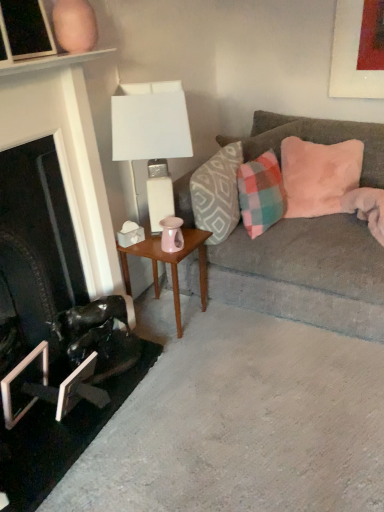
What do you see at coordinates (16, 377) in the screenshot?
I see `metallic silver picture frame at lower left, which is the second picture frame in top-to-bottom order` at bounding box center [16, 377].

The width and height of the screenshot is (384, 512). Describe the element at coordinates (305, 273) in the screenshot. I see `velvet gray couch at right` at that location.

The image size is (384, 512). Find the location of `metallic silver picture frame at lower left, which appears as the first picture frame when ordered from the bottom`. metallic silver picture frame at lower left, which appears as the first picture frame when ordered from the bottom is located at coordinates (80, 389).

In order to face metallic silver picture frame at lower left, which ranks as the 3th picture frame in top-to-bottom order, should I rotate leftwards or rightwards?

A 14.842 degree turn to the left will do.

Identify the location of matte black picture frame at upper left, the first picture frame viewed from the top. (26, 29).

Where is `plaid fabric pillow at right, the 2th pillow when ordered from right to left`? Image resolution: width=384 pixels, height=512 pixels. plaid fabric pillow at right, the 2th pillow when ordered from right to left is located at coordinates (261, 193).

Can we say shiny black swivel chair at lower left lies outside pink plush pillow at upper right, arranged as the third pillow when viewed from the left?

Indeed, shiny black swivel chair at lower left is completely outside pink plush pillow at upper right, arranged as the third pillow when viewed from the left.

Considering the sizes of objects shiny black swivel chair at lower left and pink plush pillow at upper right, arranged as the third pillow when viewed from the left, in the image provided, who is wider, shiny black swivel chair at lower left or pink plush pillow at upper right, arranged as the third pillow when viewed from the left,?

Wider between the two is pink plush pillow at upper right, arranged as the third pillow when viewed from the left.

Is shiny black swivel chair at lower left to the left of pink plush pillow at upper right, arranged as the third pillow when viewed from the left, from the viewer's perspective?

Indeed, shiny black swivel chair at lower left is positioned on the left side of pink plush pillow at upper right, arranged as the third pillow when viewed from the left.

From a real-world perspective, is shiny black swivel chair at lower left positioned above or below pink plush pillow at upper right, arranged as the third pillow when viewed from the left?

shiny black swivel chair at lower left is situated lower than pink plush pillow at upper right, arranged as the third pillow when viewed from the left, in the real world.

Considering the relative sizes of matte black picture frame at upper left, the first picture frame viewed from the top, and wooden side table at center in the image provided, is matte black picture frame at upper left, the first picture frame viewed from the top, smaller than wooden side table at center?

Correct, matte black picture frame at upper left, the first picture frame viewed from the top, occupies less space than wooden side table at center.

Is matte black picture frame at upper left, which is the third picture frame in bottom-to-top order, turned away from wooden side table at center?

No, matte black picture frame at upper left, which is the third picture frame in bottom-to-top order, is not facing away from wooden side table at center.

From the picture: Does matte black picture frame at upper left, which is the third picture frame in bottom-to-top order, appear on the left side of wooden side table at center?

Yes, matte black picture frame at upper left, which is the third picture frame in bottom-to-top order, is to the left of wooden side table at center.

From the image's perspective, relative to wooden side table at center, is matte black picture frame at upper left, the first picture frame viewed from the top, above or below?

matte black picture frame at upper left, the first picture frame viewed from the top, is above wooden side table at center.

Is the surface of wooden side table at center in direct contact with metallic silver picture frame at lower left, which is the second picture frame in top-to-bottom order?

There is a gap between wooden side table at center and metallic silver picture frame at lower left, which is the second picture frame in top-to-bottom order.

From the image's perspective, does wooden side table at center appear lower than metallic silver picture frame at lower left, which is the second picture frame in top-to-bottom order?

Actually, wooden side table at center appears above metallic silver picture frame at lower left, which is the second picture frame in top-to-bottom order, in the image.

Considering the relative positions of wooden side table at center and metallic silver picture frame at lower left, which is the 2th picture frame in bottom-to-top order, in the image provided, is wooden side table at center to the right of metallic silver picture frame at lower left, which is the 2th picture frame in bottom-to-top order, from the viewer's perspective?

Yes, wooden side table at center is to the right of metallic silver picture frame at lower left, which is the 2th picture frame in bottom-to-top order.

Does wooden side table at center have a lesser height compared to metallic silver picture frame at lower left, which is the 2th picture frame in bottom-to-top order?

Incorrect, the height of wooden side table at center does not fall short of that of metallic silver picture frame at lower left, which is the 2th picture frame in bottom-to-top order.

Considering the relative sizes of matte black picture frame at upper left, which is the third picture frame in bottom-to-top order, and plaid fabric pillow at right, the 2th pillow positioned from the left, in the image provided, is matte black picture frame at upper left, which is the third picture frame in bottom-to-top order, thinner than plaid fabric pillow at right, the 2th pillow positioned from the left,?

Indeed, matte black picture frame at upper left, which is the third picture frame in bottom-to-top order, has a lesser width compared to plaid fabric pillow at right, the 2th pillow positioned from the left.

Based on the photo, from a real-world perspective, is matte black picture frame at upper left, the first picture frame viewed from the top, physically below plaid fabric pillow at right, the 2th pillow positioned from the left?

No, from a real-world perspective, matte black picture frame at upper left, the first picture frame viewed from the top, is not beneath plaid fabric pillow at right, the 2th pillow positioned from the left.

Is plaid fabric pillow at right, the 2th pillow positioned from the left, at the back of matte black picture frame at upper left, which is the third picture frame in bottom-to-top order?

Result: matte black picture frame at upper left, which is the third picture frame in bottom-to-top order, does not have its back to plaid fabric pillow at right, the 2th pillow positioned from the left.

Considering the sizes of white ceramic table lamp at upper center and pink plush pillow at upper right, the first pillow positioned from the right, in the image, is white ceramic table lamp at upper center wider or thinner than pink plush pillow at upper right, the first pillow positioned from the right,?

In the image, white ceramic table lamp at upper center appears to be more narrow than pink plush pillow at upper right, the first pillow positioned from the right.

Considering the relative sizes of white ceramic table lamp at upper center and pink plush pillow at upper right, the first pillow positioned from the right, in the image provided, is white ceramic table lamp at upper center smaller than pink plush pillow at upper right, the first pillow positioned from the right,?

Indeed, white ceramic table lamp at upper center has a smaller size compared to pink plush pillow at upper right, the first pillow positioned from the right.

Is white ceramic table lamp at upper center not inside pink plush pillow at upper right, arranged as the third pillow when viewed from the left?

Yes, white ceramic table lamp at upper center is located beyond the bounds of pink plush pillow at upper right, arranged as the third pillow when viewed from the left.

How far apart are white ceramic table lamp at upper center and pink plush pillow at upper right, the first pillow positioned from the right?

white ceramic table lamp at upper center is 31.34 inches away from pink plush pillow at upper right, the first pillow positioned from the right.

Is metallic silver picture frame at lower left, which is the 2th picture frame in bottom-to-top order, taller than white ceramic table lamp at upper center?

No.

Is metallic silver picture frame at lower left, which is the 2th picture frame in bottom-to-top order, facing towards white ceramic table lamp at upper center?

No, metallic silver picture frame at lower left, which is the 2th picture frame in bottom-to-top order, is not aimed at white ceramic table lamp at upper center.

Would you say metallic silver picture frame at lower left, which is the 2th picture frame in bottom-to-top order, is outside white ceramic table lamp at upper center?

Yes.

Is wooden side table at center in front of metallic silver picture frame at lower left, which appears as the first picture frame when ordered from the bottom?

No, wooden side table at center is further to the viewer.

From the image's perspective, is wooden side table at center under metallic silver picture frame at lower left, which ranks as the 3th picture frame in top-to-bottom order?

No, from the image's perspective, wooden side table at center is not below metallic silver picture frame at lower left, which ranks as the 3th picture frame in top-to-bottom order.

In terms of size, does wooden side table at center appear bigger or smaller than metallic silver picture frame at lower left, which appears as the first picture frame when ordered from the bottom?

Considering their sizes, wooden side table at center takes up more space than metallic silver picture frame at lower left, which appears as the first picture frame when ordered from the bottom.

Where is `swivel chair below the pink plush pillow at upper right, the first pillow positioned from the right (from a real-world perspective)`? swivel chair below the pink plush pillow at upper right, the first pillow positioned from the right (from a real-world perspective) is located at coordinates (98, 336).

Locate an element on the screen. table that appears behind the matte black picture frame at upper left, the first picture frame viewed from the top is located at coordinates [x=170, y=264].

Based on their spatial positions, is shiny black swivel chair at lower left or metallic silver picture frame at lower left, which ranks as the 3th picture frame in top-to-bottom order, further from patterned fabric pillow at center, acting as the 3th pillow starting from the right?

metallic silver picture frame at lower left, which ranks as the 3th picture frame in top-to-bottom order.

Based on their spatial positions, is velvet gray couch at right or shiny black swivel chair at lower left further from pink plush pillow at upper right, the first pillow positioned from the right?

The object further to pink plush pillow at upper right, the first pillow positioned from the right, is shiny black swivel chair at lower left.

Based on their spatial positions, is plaid fabric pillow at right, the 2th pillow positioned from the left, or metallic silver picture frame at lower left, which ranks as the 3th picture frame in top-to-bottom order, further from metallic silver picture frame at lower left, which is the second picture frame in top-to-bottom order?

Based on the image, plaid fabric pillow at right, the 2th pillow positioned from the left, appears to be further to metallic silver picture frame at lower left, which is the second picture frame in top-to-bottom order.

When comparing their distances from velvet gray couch at right, does metallic silver picture frame at lower left, which ranks as the 3th picture frame in top-to-bottom order, or wooden side table at center seem further?

Among the two, metallic silver picture frame at lower left, which ranks as the 3th picture frame in top-to-bottom order, is located further to velvet gray couch at right.

When comparing their distances from white ceramic table lamp at upper center, does metallic silver picture frame at lower left, which ranks as the 3th picture frame in top-to-bottom order, or metallic silver picture frame at lower left, which is the 2th picture frame in bottom-to-top order, seem closer?

metallic silver picture frame at lower left, which ranks as the 3th picture frame in top-to-bottom order.

In the scene shown: Estimate the real-world distances between objects in this image. Which object is further from white ceramic table lamp at upper center, velvet gray couch at right or plaid fabric pillow at right, the 2th pillow positioned from the left?

The object further to white ceramic table lamp at upper center is velvet gray couch at right.

Based on their spatial positions, is pink plush pillow at upper right, arranged as the third pillow when viewed from the left, or metallic silver picture frame at lower left, which is the 2th picture frame in bottom-to-top order, closer to patterned fabric pillow at center, which ranks as the 1th pillow in left-to-right order?

pink plush pillow at upper right, arranged as the third pillow when viewed from the left, lies closer to patterned fabric pillow at center, which ranks as the 1th pillow in left-to-right order, than the other object.

Estimate the real-world distances between objects in this image. Which object is closer to shiny black swivel chair at lower left, pink plush pillow at upper right, the first pillow positioned from the right, or metallic silver picture frame at lower left, which ranks as the 3th picture frame in top-to-bottom order?

metallic silver picture frame at lower left, which ranks as the 3th picture frame in top-to-bottom order, lies closer to shiny black swivel chair at lower left than the other object.

Locate an element on the screen. The height and width of the screenshot is (512, 384). swivel chair that lies between patterned fabric pillow at center, which ranks as the 1th pillow in left-to-right order, and metallic silver picture frame at lower left, which is the second picture frame in top-to-bottom order, from top to bottom is located at coordinates click(98, 336).

Identify the location of table between metallic silver picture frame at lower left, which appears as the first picture frame when ordered from the bottom, and velvet gray couch at right, in the horizontal direction. (170, 264).

Image resolution: width=384 pixels, height=512 pixels. What are the coordinates of `picture frame between white ceramic table lamp at upper center and metallic silver picture frame at lower left, which appears as the first picture frame when ordered from the bottom, in the vertical direction` in the screenshot? It's located at (16, 377).

Where is `table lamp between matte black picture frame at upper left, the first picture frame viewed from the top, and metallic silver picture frame at lower left, which ranks as the 3th picture frame in top-to-bottom order, in the up-down direction`? The height and width of the screenshot is (512, 384). table lamp between matte black picture frame at upper left, the first picture frame viewed from the top, and metallic silver picture frame at lower left, which ranks as the 3th picture frame in top-to-bottom order, in the up-down direction is located at coordinates (152, 136).